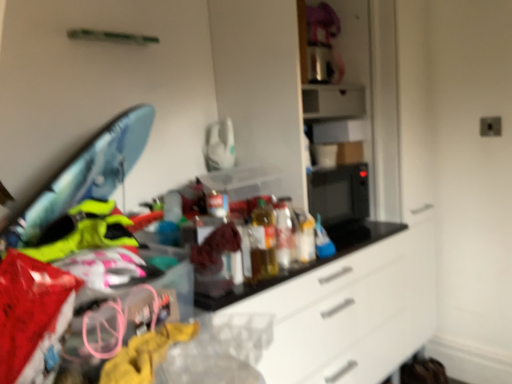
Question: Should I look upward or downward to see metallic silver toaster at upper center?

Choices:
 (A) up
 (B) down

Answer: (A)

Question: From a real-world perspective, does translucent plastic bottles at center sit lower than metallic silver toaster at upper center?

Choices:
 (A) no
 (B) yes

Answer: (B)

Question: Is translucent plastic bottles at center turned away from metallic silver toaster at upper center?

Choices:
 (A) yes
 (B) no

Answer: (B)

Question: Is translucent plastic bottles at center oriented towards metallic silver toaster at upper center?

Choices:
 (A) yes
 (B) no

Answer: (B)

Question: From the image's perspective, is translucent plastic bottles at center under metallic silver toaster at upper center?

Choices:
 (A) yes
 (B) no

Answer: (A)

Question: Is translucent plastic bottles at center with metallic silver toaster at upper center?

Choices:
 (A) yes
 (B) no

Answer: (B)

Question: Can you confirm if translucent plastic bottles at center is positioned to the right of metallic silver toaster at upper center?

Choices:
 (A) no
 (B) yes

Answer: (A)

Question: Is translucent plastic bottles at center completely or partially inside metallic silver toaster at upper center?

Choices:
 (A) yes
 (B) no

Answer: (B)

Question: Does metallic silver toaster at upper center have a greater height compared to translucent plastic bottles at center?

Choices:
 (A) no
 (B) yes

Answer: (A)

Question: From a real-world perspective, is metallic silver toaster at upper center physically above translucent plastic bottles at center?

Choices:
 (A) no
 (B) yes

Answer: (B)

Question: From the image's perspective, would you say metallic silver toaster at upper center is positioned over translucent plastic bottles at center?

Choices:
 (A) no
 (B) yes

Answer: (B)

Question: Can you confirm if metallic silver toaster at upper center is shorter than translucent plastic bottles at center?

Choices:
 (A) yes
 (B) no

Answer: (A)

Question: Considering the relative positions of metallic silver toaster at upper center and translucent plastic bottles at center in the image provided, is metallic silver toaster at upper center to the right of translucent plastic bottles at center from the viewer's perspective?

Choices:
 (A) yes
 (B) no

Answer: (A)

Question: Is translucent plastic bottles at center in front of or behind metallic silver toaster at upper center in the image?

Choices:
 (A) behind
 (B) front

Answer: (B)